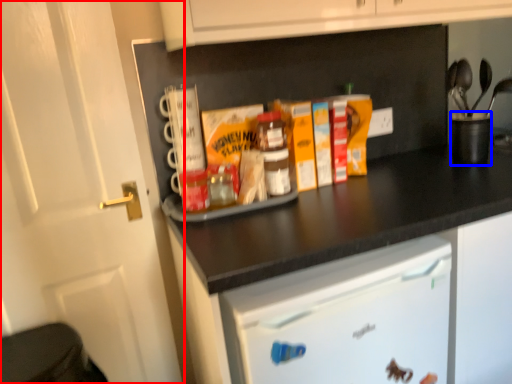
Question: Among these objects, which one is nearest to the camera, door (highlighted by a red box) or appliance (highlighted by a blue box)?

Choices:
 (A) door
 (B) appliance

Answer: (A)